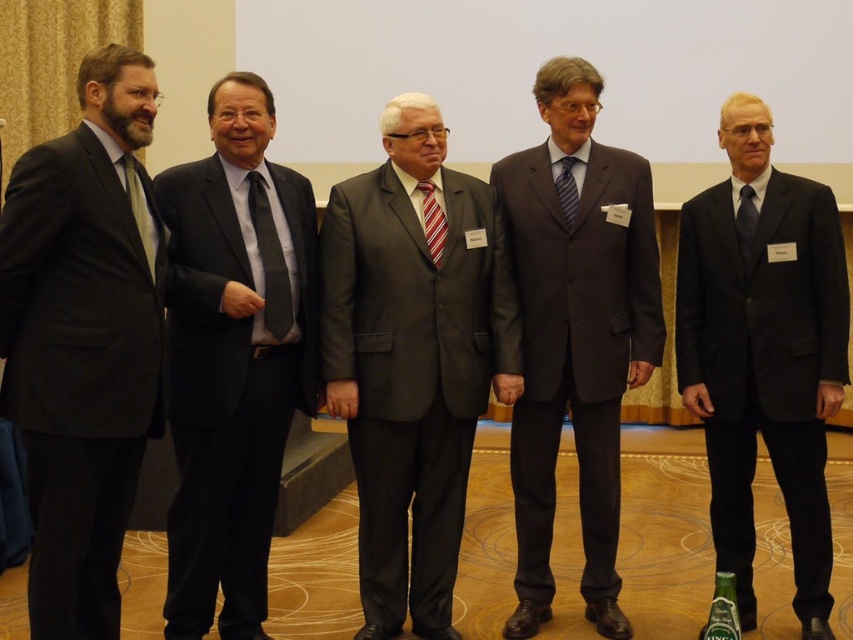
You are a photographer at the event and need to adjust the camera focus. Since the matte black suit at left and the matte gray tie at center are in the frame, which one should you focus on first to ensure they are both in focus?

The matte black suit at left is taller than the matte gray tie at center, so focusing on the taller matte black suit at left first would ensure both are within the depth of field.

You are organizing a photo shoot and need to position two key items in the scene. The matte dark gray suit at center and the dark blue silk tie at center must be arranged such that one is to the left of the other. Based on the current setup, which item is positioned to the left?

The matte dark gray suit at center is to the left of the dark blue silk tie at center.

You are a photographer at the event and need to adjust the camera height to capture both the matte gray suit at center and the matte black tie at left clearly. Which object should you focus on first to ensure proper framing?

The matte gray suit at center is much taller than the matte black tie at left, so you should focus on the matte gray suit at center first to ensure proper framing.